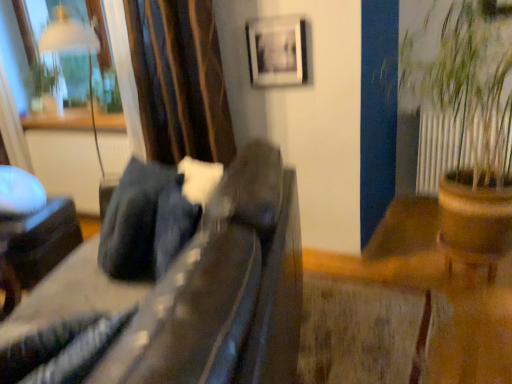
Question: Can you confirm if suede-like dark brown couch at center, which ranks as the second furniture in back-to-front order, is smaller than velvet-like brown curtain at upper left?

Choices:
 (A) yes
 (B) no

Answer: (B)

Question: Is velvet-like brown curtain at upper left located within suede-like dark brown couch at center, the 2th furniture positioned from the left?

Choices:
 (A) no
 (B) yes

Answer: (A)

Question: From a real-world perspective, is suede-like dark brown couch at center, which is the first furniture from front to back, physically below velvet-like brown curtain at upper left?

Choices:
 (A) yes
 (B) no

Answer: (A)

Question: Does suede-like dark brown couch at center, which is the first furniture from front to back, appear on the left side of velvet-like brown curtain at upper left?

Choices:
 (A) yes
 (B) no

Answer: (B)

Question: Does suede-like dark brown couch at center, which ranks as the second furniture in back-to-front order, have a lesser width compared to velvet-like brown curtain at upper left?

Choices:
 (A) no
 (B) yes

Answer: (A)

Question: Is velvet-like brown curtain at upper left at the back of suede-like dark brown couch at center, which ranks as the first furniture in right-to-left order?

Choices:
 (A) no
 (B) yes

Answer: (A)

Question: Does velvet-like brown curtain at upper left have a lesser width compared to metallic silver frame at upper center?

Choices:
 (A) yes
 (B) no

Answer: (B)

Question: Is velvet-like brown curtain at upper left to the left of metallic silver frame at upper center from the viewer's perspective?

Choices:
 (A) no
 (B) yes

Answer: (B)

Question: From a real-world perspective, is velvet-like brown curtain at upper left physically above metallic silver frame at upper center?

Choices:
 (A) yes
 (B) no

Answer: (B)

Question: Is velvet-like brown curtain at upper left not within metallic silver frame at upper center?

Choices:
 (A) yes
 (B) no

Answer: (A)

Question: Considering the relative sizes of velvet-like brown curtain at upper left and metallic silver frame at upper center in the image provided, is velvet-like brown curtain at upper left shorter than metallic silver frame at upper center?

Choices:
 (A) yes
 (B) no

Answer: (B)

Question: Can you confirm if velvet-like brown curtain at upper left is taller than metallic silver frame at upper center?

Choices:
 (A) yes
 (B) no

Answer: (A)

Question: Can you confirm if transparent glass window at upper left is bigger than brown wooden pot at right?

Choices:
 (A) yes
 (B) no

Answer: (B)